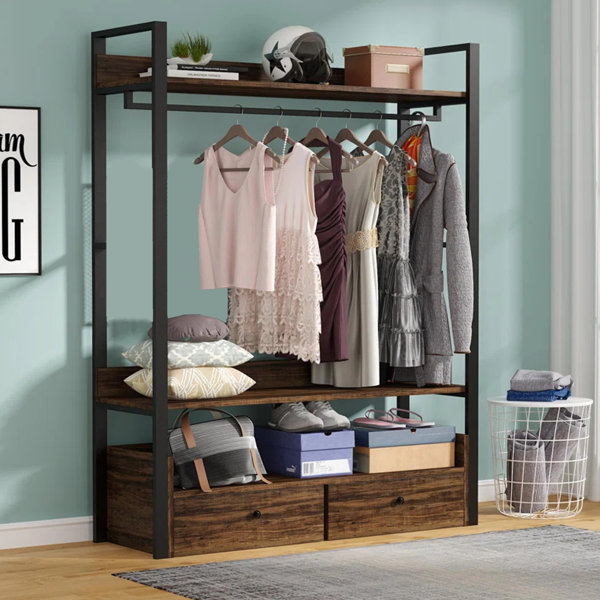
Locate an element on the screen. Image resolution: width=600 pixels, height=600 pixels. things in the room that are gray is located at coordinates (220, 436), (295, 423), (330, 419), (407, 321), (433, 313), (367, 303), (535, 380), (529, 456), (560, 451), (531, 549).